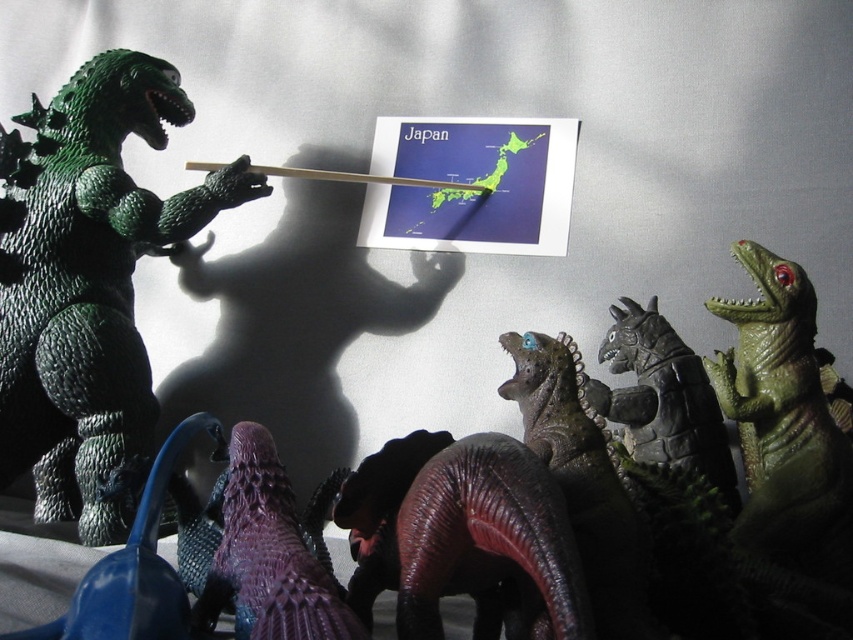
Is green rubbery dinosaur at left smaller than purple matte dinosaur at lower center?

No, green rubbery dinosaur at left is not smaller than purple matte dinosaur at lower center.

Which is below, green rubbery dinosaur at left or purple matte dinosaur at lower center?

purple matte dinosaur at lower center is below.

You are a GUI agent. You are given a task and a screenshot of the screen. Output one action in this format:
    pyautogui.click(x=<x>, y=<y>)
    Task: Click on the green rubbery dinosaur at left
    The width and height of the screenshot is (853, 640).
    Given the screenshot: What is the action you would take?
    pyautogui.click(x=90, y=288)